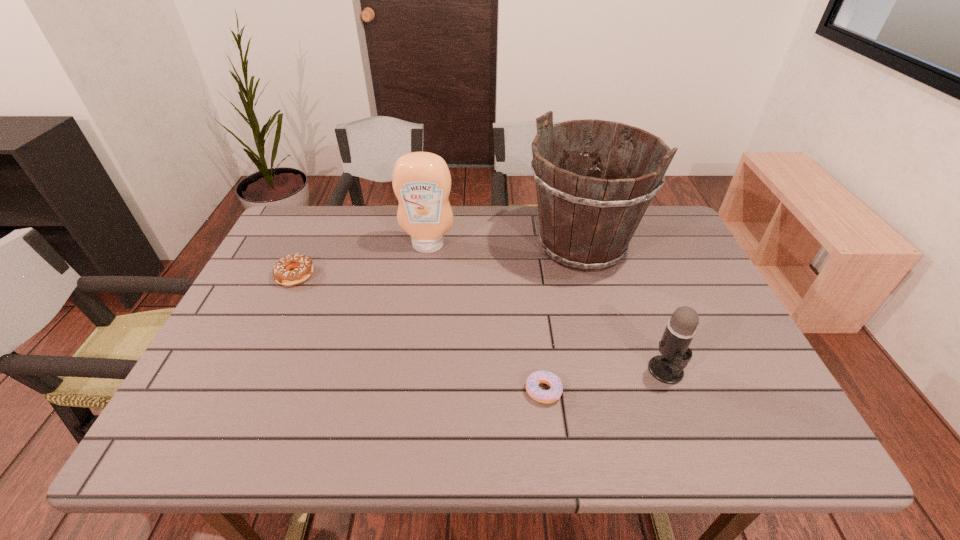
The image size is (960, 540). I want to click on bucket, so click(587, 221).

Locate an element on the screen. This screenshot has height=540, width=960. the second tallest object is located at coordinates (421, 181).

What are the coordinates of `the fourth object from right to left` in the screenshot? It's located at (421, 181).

The image size is (960, 540). What are the coordinates of `microphone` in the screenshot? It's located at (668, 367).

Identify the location of the taller doughnut. (283, 274).

Find the location of a particular element. This screenshot has height=540, width=960. the second shortest object is located at coordinates (283, 274).

The image size is (960, 540). I want to click on the right doughnut, so click(534, 391).

What are the coordinates of `the shortest object` in the screenshot? It's located at (534, 391).

The width and height of the screenshot is (960, 540). I want to click on vacant area situated on the front of the bucket, so click(x=623, y=393).

Find the location of `free location located 0.180m on the label of the second object from left to right`. free location located 0.180m on the label of the second object from left to right is located at coordinates (420, 298).